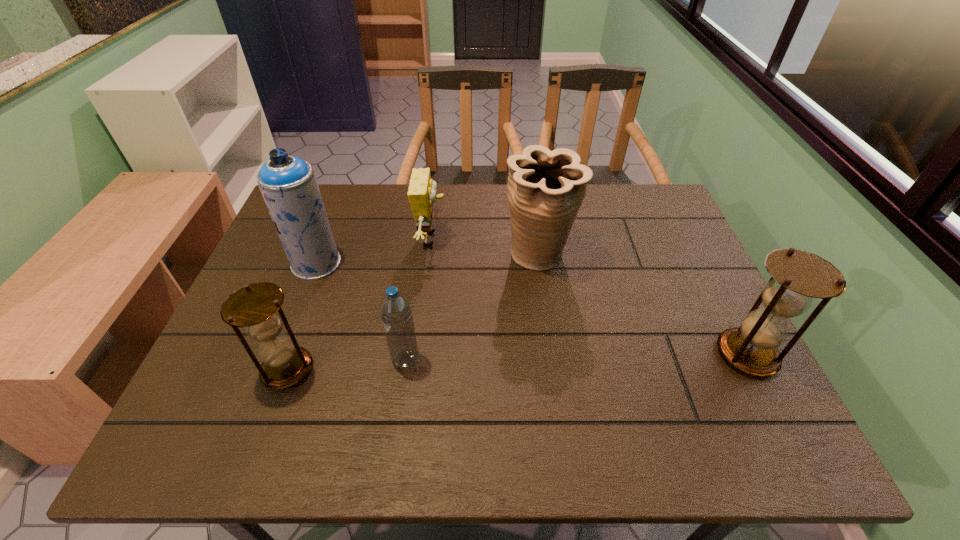
The height and width of the screenshot is (540, 960). Find the location of `vacant area at the far edge`. vacant area at the far edge is located at coordinates (382, 205).

Identify the location of vacant space at the near edge. (298, 390).

I want to click on free location at the left edge of the desktop, so click(296, 296).

Where is `free space at the right edge of the desktop`? The height and width of the screenshot is (540, 960). free space at the right edge of the desktop is located at coordinates 657,310.

At what (x,y) coordinates should I click in order to perform the action: click on vacant region at the far left corner of the desktop. Please return your answer as a coordinate pair (x, y). This screenshot has height=540, width=960. Looking at the image, I should click on [329, 190].

Image resolution: width=960 pixels, height=540 pixels. Identify the location of vacant area that lies between the tallest object and the rightmost object. (532, 309).

Locate an element on the screen. The width and height of the screenshot is (960, 540). vacant area that lies between the right hourglass and the urn is located at coordinates click(643, 305).

You are a GUI agent. You are given a task and a screenshot of the screen. Output one action in this format:
    pyautogui.click(x=<x>, y=<y>)
    Task: Click on the free space between the rightmost object and the shorter hourglass
    This screenshot has width=960, height=540.
    Given the screenshot: What is the action you would take?
    pyautogui.click(x=517, y=362)

What are the coordinates of `unoccupied area between the left hourglass and the right hourglass` in the screenshot? It's located at (517, 362).

Locate an element on the screen. free space between the rightmost object and the aerosol can is located at coordinates (532, 309).